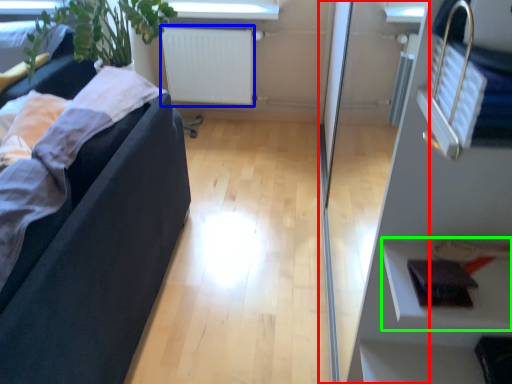
Question: Estimate the real-world distances between objects in this image. Which object is farther from glass door (highlighted by a red box), radiator (highlighted by a blue box) or shelf (highlighted by a green box)?

Choices:
 (A) radiator
 (B) shelf

Answer: (B)